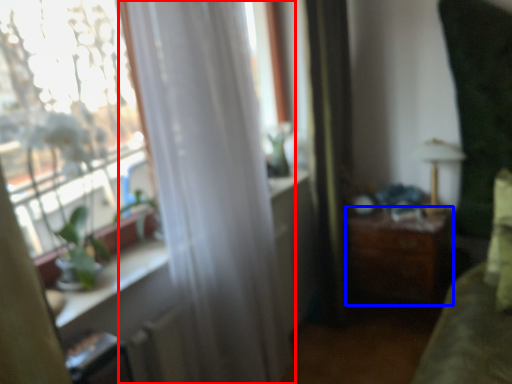
Question: Which object appears farthest to the camera in this image, curtain (highlighted by a red box) or table (highlighted by a blue box)?

Choices:
 (A) curtain
 (B) table

Answer: (B)